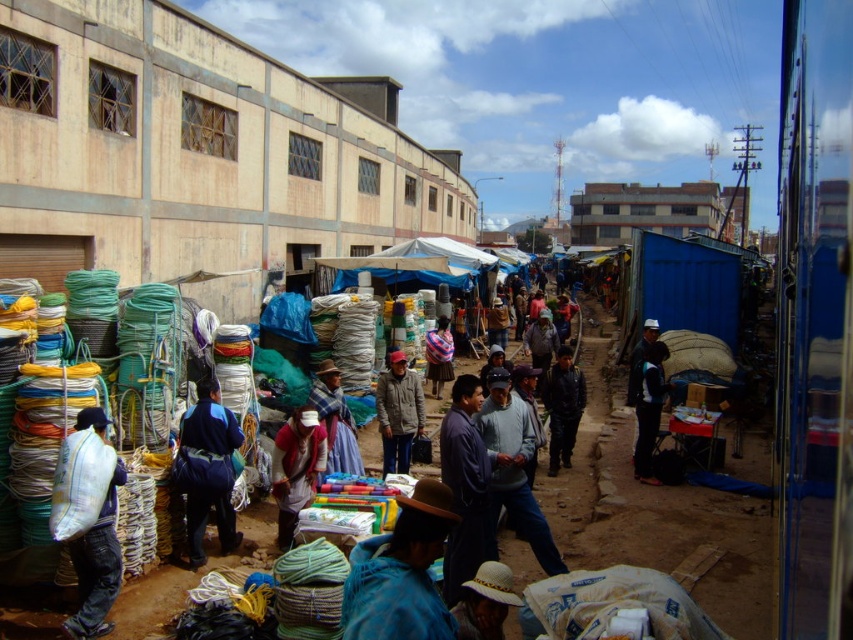
You are a vendor at the market and want to place both the white straw hat at lower center and the striped fabric bag at center on a shelf that can only hold items narrower than 30 cm. Which item should you place first to ensure both fit?

The white straw hat at lower center has a smaller width than the striped fabric bag at center, so place the white straw hat at lower center first to ensure both fit within the shelf constraints.

You are a customer at the market and want to pick up both the dark gray jacket at center and the dark blue fabric jacket at center. If you are standing at the entrance of the market, which jacket should you go to first to minimize the distance walked?

The dark gray jacket at center is 3.81 meters away from the dark blue fabric jacket at center. Since both jackets are at the center of the market, you should go to whichever is closer to your current position at the entrance. However, without knowing their exact positions relative to the entrance, it is impossible to determine which one is closer.